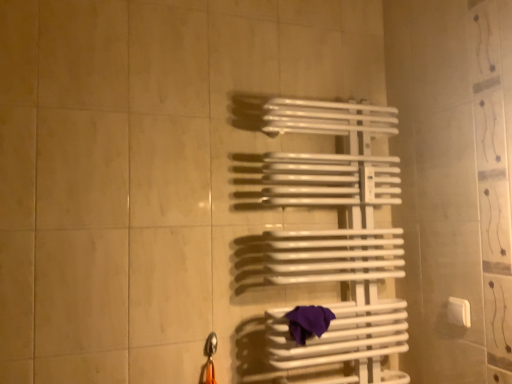
Measure the distance between point [333,314] and camera.

The distance of point [333,314] from camera is 1.32 meters.

In order to face purple fabric at center, should I rotate leftwards or rightwards?

It's best to rotate right around 7.266 degrees.

Find the location of a particular element. purple fabric at center is located at coordinates pyautogui.click(x=308, y=322).

What do you see at coordinates (308, 322) in the screenshot?
I see `purple fabric at center` at bounding box center [308, 322].

Where is `purple fabric at center`? The width and height of the screenshot is (512, 384). purple fabric at center is located at coordinates (308, 322).